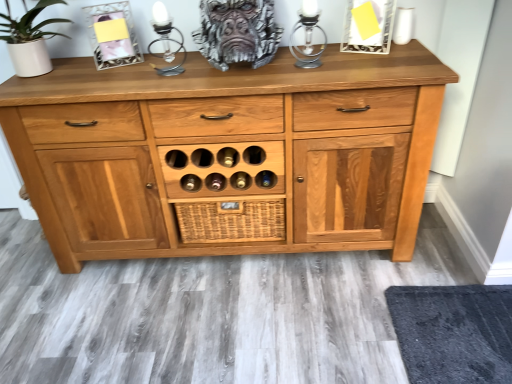
In order to face metallic silver candle holder at upper center, which is the first candle holder in left-to-right order, should I rotate leftwards or rightwards?

To face it directly, rotate left by 11.949 degrees.

The height and width of the screenshot is (384, 512). What do you see at coordinates (231, 221) in the screenshot?
I see `woven brown basket at center` at bounding box center [231, 221].

In order to click on black textured mat at lower right in this screenshot , I will do 453,332.

Is the depth of black textured mat at lower right less than that of metallic silver candle holder at upper center, which is counted as the 2th candle holder, starting from the right?

Yes, the depth of black textured mat at lower right is less than that of metallic silver candle holder at upper center, which is counted as the 2th candle holder, starting from the right.

From a real-world perspective, is black textured mat at lower right positioned under metallic silver candle holder at upper center, which is the first candle holder in left-to-right order, based on gravity?

Yes.

Is the surface of black textured mat at lower right in direct contact with metallic silver candle holder at upper center, which is the first candle holder in left-to-right order?

No, black textured mat at lower right is not touching metallic silver candle holder at upper center, which is the first candle holder in left-to-right order.

Is black textured mat at lower right touching woven brown basket at center?

No, black textured mat at lower right is not beside woven brown basket at center.

Is point (409, 287) farther from camera compared to point (221, 235)?

No, (409, 287) is in front of (221, 235).

Between black textured mat at lower right and woven brown basket at center, which one has smaller size?

woven brown basket at center is smaller.

Measure the distance between black textured mat at lower right and woven brown basket at center.

black textured mat at lower right and woven brown basket at center are 30.35 inches apart from each other.

From the image's perspective, which one is positioned higher, silver metallic candle holder at upper center, the second candle holder viewed from the left, or woven brown basket at center?

silver metallic candle holder at upper center, the second candle holder viewed from the left, appears higher in the image.

Is silver metallic candle holder at upper center, the first candle holder viewed from the right, looking in the opposite direction of woven brown basket at center?

silver metallic candle holder at upper center, the first candle holder viewed from the right, does not have its back to woven brown basket at center.

From the picture: From a real-world perspective, between silver metallic candle holder at upper center, the second candle holder viewed from the left, and woven brown basket at center, who is vertically higher?

silver metallic candle holder at upper center, the second candle holder viewed from the left.

Between silver metallic candle holder at upper center, the second candle holder viewed from the left, and woven brown basket at center, which one has larger width?

With larger width is silver metallic candle holder at upper center, the second candle holder viewed from the left.

Can you confirm if metallic silver candle holder at upper center, which is counted as the 2th candle holder, starting from the right, is wider than black textured mat at lower right?

No.

From a real-world perspective, is metallic silver candle holder at upper center, which is counted as the 2th candle holder, starting from the right, located higher than black textured mat at lower right?

Yes.

Could you tell me if metallic silver candle holder at upper center, which is counted as the 2th candle holder, starting from the right, is facing black textured mat at lower right?

No.

From the image's perspective, is metallic silver candle holder at upper center, which is the first candle holder in left-to-right order, located above black textured mat at lower right?

Yes.

The width and height of the screenshot is (512, 384). What are the coordinates of `candle holder on the left of woven brown basket at center` in the screenshot? It's located at (166, 41).

From the picture: Is metallic silver candle holder at upper center, which is the first candle holder in left-to-right order, at the left side of woven brown basket at center?

Indeed, metallic silver candle holder at upper center, which is the first candle holder in left-to-right order, is positioned on the left side of woven brown basket at center.

Which of these two, metallic silver candle holder at upper center, which is counted as the 2th candle holder, starting from the right, or woven brown basket at center, is thinner?

With smaller width is woven brown basket at center.

From a real-world perspective, relative to woven brown basket at center, is metallic silver candle holder at upper center, which is the first candle holder in left-to-right order, vertically above or below?

metallic silver candle holder at upper center, which is the first candle holder in left-to-right order, is situated higher than woven brown basket at center in the real world.

Consider the image. Does silver metallic candle holder at upper center, the first candle holder viewed from the right, have a greater height compared to black textured mat at lower right?

Yes, silver metallic candle holder at upper center, the first candle holder viewed from the right, is taller than black textured mat at lower right.

Would you say silver metallic candle holder at upper center, the first candle holder viewed from the right, is outside black textured mat at lower right?

Indeed, silver metallic candle holder at upper center, the first candle holder viewed from the right, is completely outside black textured mat at lower right.

The image size is (512, 384). I want to click on mat below the silver metallic candle holder at upper center, the second candle holder viewed from the left (from the image's perspective), so click(453, 332).

Considering the sizes of silver metallic candle holder at upper center, the first candle holder viewed from the right, and black textured mat at lower right in the image, is silver metallic candle holder at upper center, the first candle holder viewed from the right, wider or thinner than black textured mat at lower right?

silver metallic candle holder at upper center, the first candle holder viewed from the right, is thinner than black textured mat at lower right.

Considering the relative positions of silver metallic candle holder at upper center, the first candle holder viewed from the right, and metallic silver candle holder at upper center, which is counted as the 2th candle holder, starting from the right, in the image provided, is silver metallic candle holder at upper center, the first candle holder viewed from the right, to the left or to the right of metallic silver candle holder at upper center, which is counted as the 2th candle holder, starting from the right,?

From the image, it's evident that silver metallic candle holder at upper center, the first candle holder viewed from the right, is to the right of metallic silver candle holder at upper center, which is counted as the 2th candle holder, starting from the right.

Considering the sizes of silver metallic candle holder at upper center, the second candle holder viewed from the left, and metallic silver candle holder at upper center, which is counted as the 2th candle holder, starting from the right, in the image, is silver metallic candle holder at upper center, the second candle holder viewed from the left, bigger or smaller than metallic silver candle holder at upper center, which is counted as the 2th candle holder, starting from the right,?

silver metallic candle holder at upper center, the second candle holder viewed from the left, is smaller than metallic silver candle holder at upper center, which is counted as the 2th candle holder, starting from the right.

Considering the sizes of objects silver metallic candle holder at upper center, the first candle holder viewed from the right, and metallic silver candle holder at upper center, which is the first candle holder in left-to-right order, in the image provided, who is wider, silver metallic candle holder at upper center, the first candle holder viewed from the right, or metallic silver candle holder at upper center, which is the first candle holder in left-to-right order,?

With larger width is metallic silver candle holder at upper center, which is the first candle holder in left-to-right order.

How different are the orientations of silver metallic candle holder at upper center, the second candle holder viewed from the left, and metallic silver candle holder at upper center, which is the first candle holder in left-to-right order, in degrees?

There is a 0.00212-degree angle between the facing directions of silver metallic candle holder at upper center, the second candle holder viewed from the left, and metallic silver candle holder at upper center, which is the first candle holder in left-to-right order.

From the image's perspective, count 1st candle holders upward from the black textured mat at lower right and point to it. Please provide its 2D coordinates.

[(166, 41)]

This screenshot has width=512, height=384. I want to click on crate behind the black textured mat at lower right, so click(231, 221).

From the image, which object appears to be nearer to metallic silver candle holder at upper center, which is counted as the 2th candle holder, starting from the right, woven brown basket at center or black textured mat at lower right?

woven brown basket at center is positioned closer to the anchor metallic silver candle holder at upper center, which is counted as the 2th candle holder, starting from the right.

Looking at the image, which one is located closer to silver metallic candle holder at upper center, the second candle holder viewed from the left, metallic silver candle holder at upper center, which is counted as the 2th candle holder, starting from the right, or black textured mat at lower right?

Based on the image, metallic silver candle holder at upper center, which is counted as the 2th candle holder, starting from the right, appears to be nearer to silver metallic candle holder at upper center, the second candle holder viewed from the left.

From the image, which object appears to be farther from woven brown basket at center, black textured mat at lower right or silver metallic candle holder at upper center, the second candle holder viewed from the left?

Among the two, black textured mat at lower right is located further to woven brown basket at center.

When comparing their distances from woven brown basket at center, does black textured mat at lower right or metallic silver candle holder at upper center, which is counted as the 2th candle holder, starting from the right, seem closer?

metallic silver candle holder at upper center, which is counted as the 2th candle holder, starting from the right, is closer to woven brown basket at center.

Looking at the image, which one is located further to woven brown basket at center, metallic silver candle holder at upper center, which is counted as the 2th candle holder, starting from the right, or silver metallic candle holder at upper center, the second candle holder viewed from the left?

silver metallic candle holder at upper center, the second candle holder viewed from the left.

Looking at the image, which one is located closer to woven brown basket at center, silver metallic candle holder at upper center, the second candle holder viewed from the left, or black textured mat at lower right?

Among the two, silver metallic candle holder at upper center, the second candle holder viewed from the left, is located nearer to woven brown basket at center.

Looking at this image, from the image, which object appears to be farther from black textured mat at lower right, woven brown basket at center or silver metallic candle holder at upper center, the second candle holder viewed from the left?

silver metallic candle holder at upper center, the second candle holder viewed from the left, is further to black textured mat at lower right.

From the image, which object appears to be nearer to woven brown basket at center, metallic silver candle holder at upper center, which is the first candle holder in left-to-right order, or black textured mat at lower right?

Among the two, metallic silver candle holder at upper center, which is the first candle holder in left-to-right order, is located nearer to woven brown basket at center.

Locate an element on the screen. crate between silver metallic candle holder at upper center, the second candle holder viewed from the left, and black textured mat at lower right in the up-down direction is located at coordinates (231, 221).

Locate an element on the screen. The width and height of the screenshot is (512, 384). crate between metallic silver candle holder at upper center, which is counted as the 2th candle holder, starting from the right, and black textured mat at lower right is located at coordinates (231, 221).

You are a GUI agent. You are given a task and a screenshot of the screen. Output one action in this format:
    pyautogui.click(x=<x>, y=<y>)
    Task: Click on the candle holder between silver metallic candle holder at upper center, the second candle holder viewed from the left, and black textured mat at lower right, in the vertical direction
    
    Given the screenshot: What is the action you would take?
    pyautogui.click(x=166, y=41)

Where is `candle holder between silver metallic candle holder at upper center, the second candle holder viewed from the left, and woven brown basket at center in the up-down direction`? The height and width of the screenshot is (384, 512). candle holder between silver metallic candle holder at upper center, the second candle holder viewed from the left, and woven brown basket at center in the up-down direction is located at coordinates (166, 41).